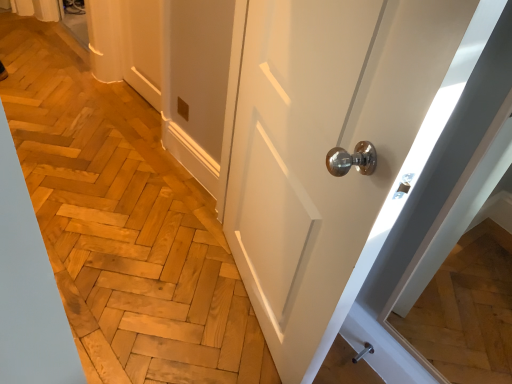
Question: Considering the relative sizes of white glossy door at center and polished metallic door handle at lower right in the image provided, is white glossy door at center shorter than polished metallic door handle at lower right?

Choices:
 (A) no
 (B) yes

Answer: (A)

Question: From the image's perspective, is white glossy door at center over polished metallic door handle at lower right?

Choices:
 (A) yes
 (B) no

Answer: (A)

Question: From a real-world perspective, is white glossy door at center over polished metallic door handle at lower right?

Choices:
 (A) yes
 (B) no

Answer: (A)

Question: Is white glossy door at center in contact with polished metallic door handle at lower right?

Choices:
 (A) no
 (B) yes

Answer: (A)

Question: Could you tell me if white glossy door at center is turned towards polished metallic door handle at lower right?

Choices:
 (A) yes
 (B) no

Answer: (B)

Question: From a real-world perspective, is white glossy door at center located beneath polished metallic door handle at lower right?

Choices:
 (A) no
 (B) yes

Answer: (A)

Question: Considering the relative positions of polished metallic door handle at lower right and white glossy door at center in the image provided, is polished metallic door handle at lower right to the right of white glossy door at center from the viewer's perspective?

Choices:
 (A) no
 (B) yes

Answer: (B)

Question: Is polished metallic door handle at lower right far from white glossy door at center?

Choices:
 (A) no
 (B) yes

Answer: (A)

Question: Does polished metallic door handle at lower right have a smaller size compared to white glossy door at center?

Choices:
 (A) yes
 (B) no

Answer: (A)

Question: From the image's perspective, is polished metallic door handle at lower right above white glossy door at center?

Choices:
 (A) no
 (B) yes

Answer: (A)

Question: Is polished metallic door handle at lower right looking in the opposite direction of white glossy door at center?

Choices:
 (A) yes
 (B) no

Answer: (B)

Question: Can white glossy door at center be found inside polished metallic door handle at lower right?

Choices:
 (A) no
 (B) yes

Answer: (A)

Question: Relative to polished metallic door handle at lower right, is white glossy door at center in front or behind?

Choices:
 (A) behind
 (B) front

Answer: (B)